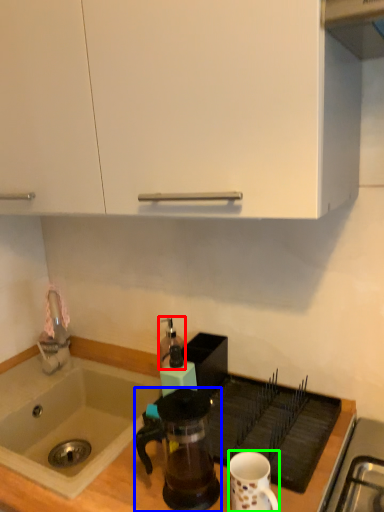
Question: Which object is positioned farthest from kitchen appliance (highlighted by a red box)? Select from coffee maker (highlighted by a blue box) and coffee cup (highlighted by a green box).

Choices:
 (A) coffee maker
 (B) coffee cup

Answer: (B)